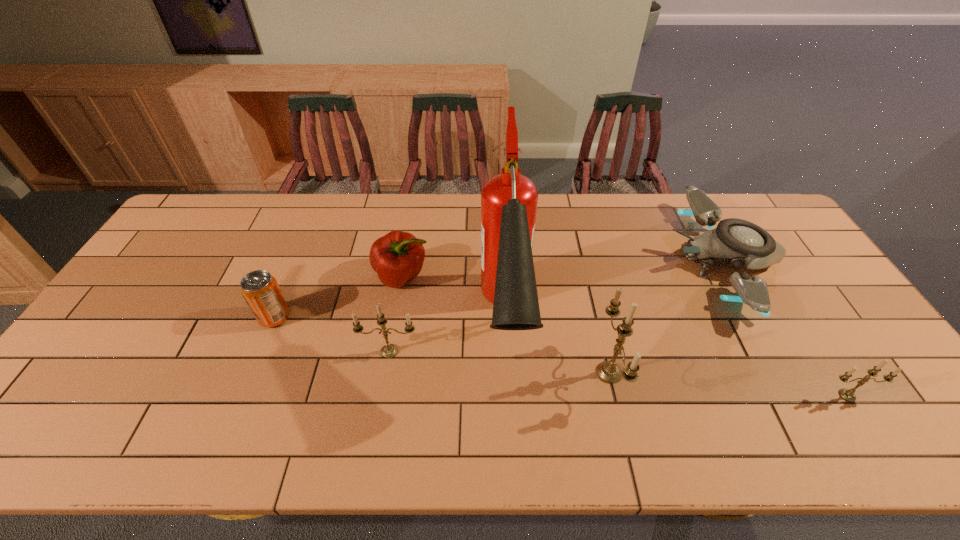
At what (x,y) coordinates should I click in order to perform the action: click on vacant position in the image that satisfies the following two spatial constraints: 1. on the back side of the bell pepper; 2. on the right side of the leftmost object. Please return your answer as a coordinate pair (x, y). This screenshot has height=540, width=960. Looking at the image, I should click on (291, 276).